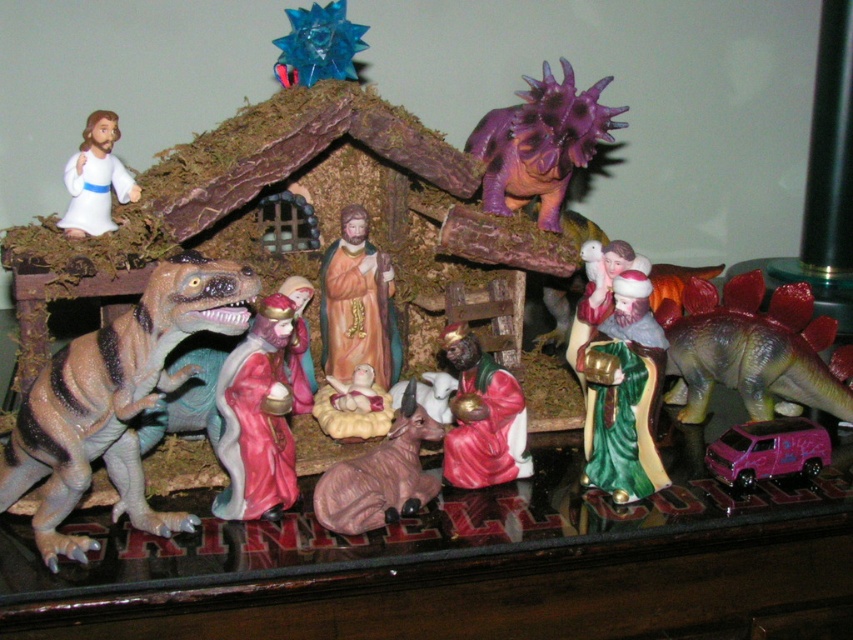
Between green glossy figurine at center-right and pink matte cow at center, which one appears on the right side from the viewer's perspective?

green glossy figurine at center-right is more to the right.

Is green glossy figurine at center-right wider than pink matte cow at center?

Incorrect, green glossy figurine at center-right's width does not surpass pink matte cow at center's.

Describe the element at coordinates (622, 392) in the screenshot. I see `green glossy figurine at center-right` at that location.

Identify the location of green glossy figurine at center-right. (622, 392).

Does point (466, 412) come behind point (407, 444)?

Yes, it is.

Does matte red figurine at center have a lesser width compared to pink matte cow at center?

Yes.

Does point (485, 356) lie behind point (389, 467)?

Yes, point (485, 356) is behind point (389, 467).

Identify the location of matte red figurine at center. (482, 417).

Can you confirm if shiny purple dinosaur at right is taller than matte red figurine at center?

No.

Who is positioned more to the right, shiny purple dinosaur at right or matte red figurine at center?

shiny purple dinosaur at right is more to the right.

Does point (763, 323) come closer to viewer compared to point (459, 392)?

No.

At what (x,y) coordinates should I click in order to perform the action: click on shiny purple dinosaur at right. Please return your answer as a coordinate pair (x, y). This screenshot has width=853, height=640. Looking at the image, I should click on (747, 360).